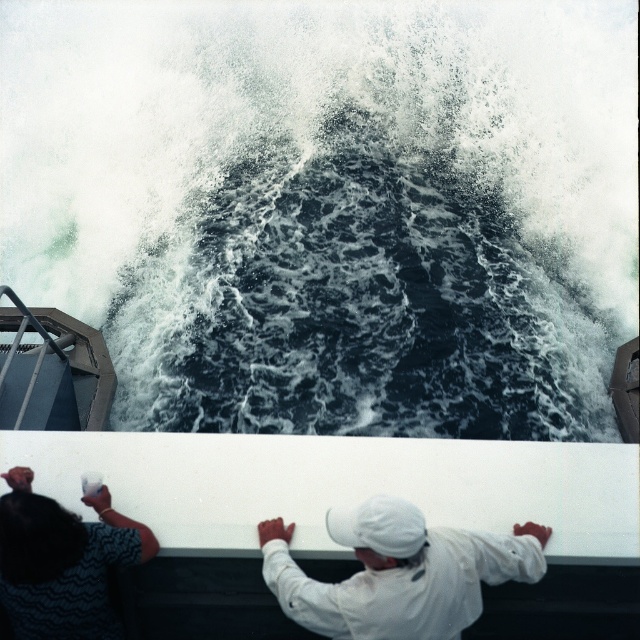
Between dark blue water at center and white matte cap at center, which one is positioned lower?

white matte cap at center is below.

Is dark blue water at center thinner than white matte cap at center?

In fact, dark blue water at center might be wider than white matte cap at center.

This screenshot has height=640, width=640. What do you see at coordinates (330, 209) in the screenshot?
I see `dark blue water at center` at bounding box center [330, 209].

Identify the location of dark blue water at center. (330, 209).

Between dark blue water at center and dark blue textured robe at lower left, which one has less height?

dark blue textured robe at lower left is shorter.

Which is more to the right, dark blue water at center or dark blue textured robe at lower left?

dark blue water at center

Where is `dark blue water at center`? dark blue water at center is located at coordinates (330, 209).

Can you confirm if white matte cap at center is shorter than dark blue textured robe at lower left?

Yes, white matte cap at center is shorter than dark blue textured robe at lower left.

Which is below, white matte cap at center or dark blue textured robe at lower left?

dark blue textured robe at lower left

Where is `white matte cap at center`? white matte cap at center is located at coordinates (397, 572).